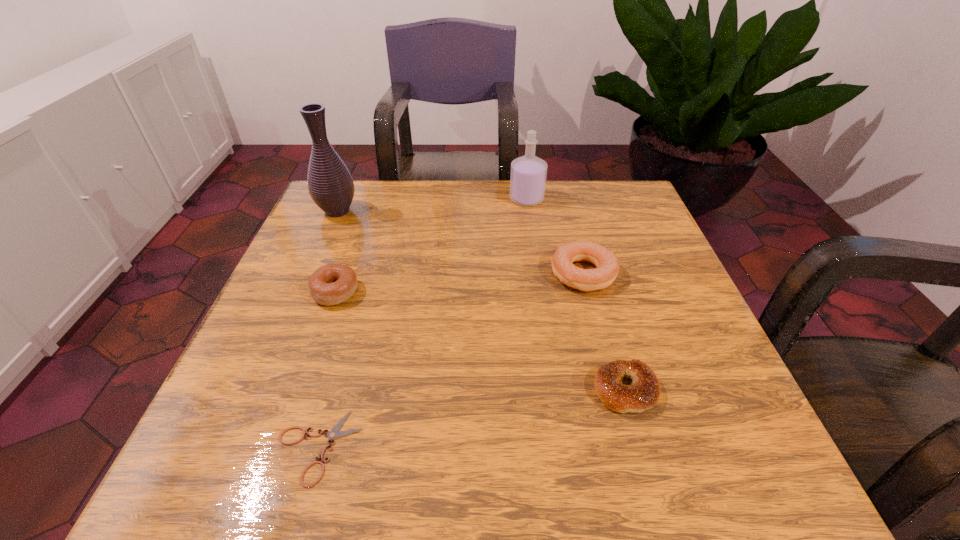
The image size is (960, 540). Find the location of `vase`. vase is located at coordinates (330, 184).

Find the location of a particular element. The height and width of the screenshot is (540, 960). perfume is located at coordinates (528, 174).

Image resolution: width=960 pixels, height=540 pixels. Find the location of `the leftmost bagel`. the leftmost bagel is located at coordinates (331, 284).

I want to click on the fifth tallest object, so click(x=644, y=392).

Locate an element on the screen. The height and width of the screenshot is (540, 960). the shortest bagel is located at coordinates pyautogui.click(x=644, y=392).

Find the location of a particular element. shears is located at coordinates (334, 433).

Find the location of `free location located 0.090m on the front of the vase`. free location located 0.090m on the front of the vase is located at coordinates (323, 246).

In order to click on free spot located on the right of the perfume in this screenshot , I will do `click(574, 199)`.

This screenshot has height=540, width=960. I want to click on blank space located 0.180m on the back of the leftmost bagel, so click(358, 226).

Locate an element on the screen. free space located on the left of the nearest bagel is located at coordinates (447, 389).